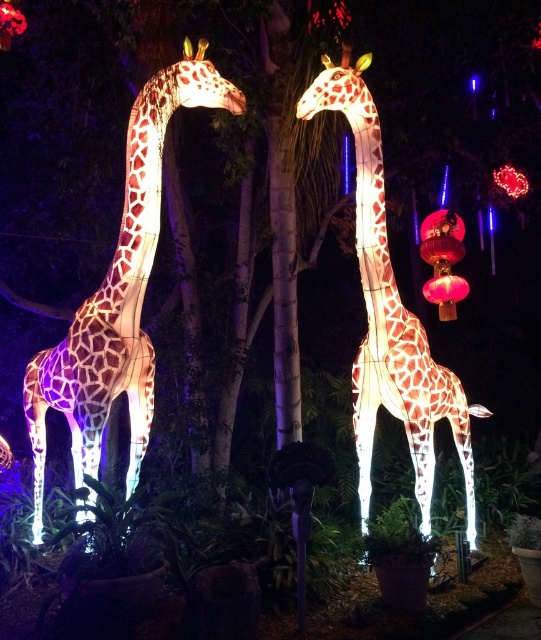
You are standing at the point marked as point (60, 388) in the image. There are two large giraffe shaped lanterns in front of you. How far apart are the two lanterns?

The two large giraffe shaped lanterns are 4.22 meters apart.

You are standing in the garden and see the illuminated mesh giraffe at left. Can you determine its exact location based on the coordinate system where the bottom left corner is the origin?

The illuminated mesh giraffe at left is located at point (118, 294) in the coordinate system where the bottom left corner is the origin.